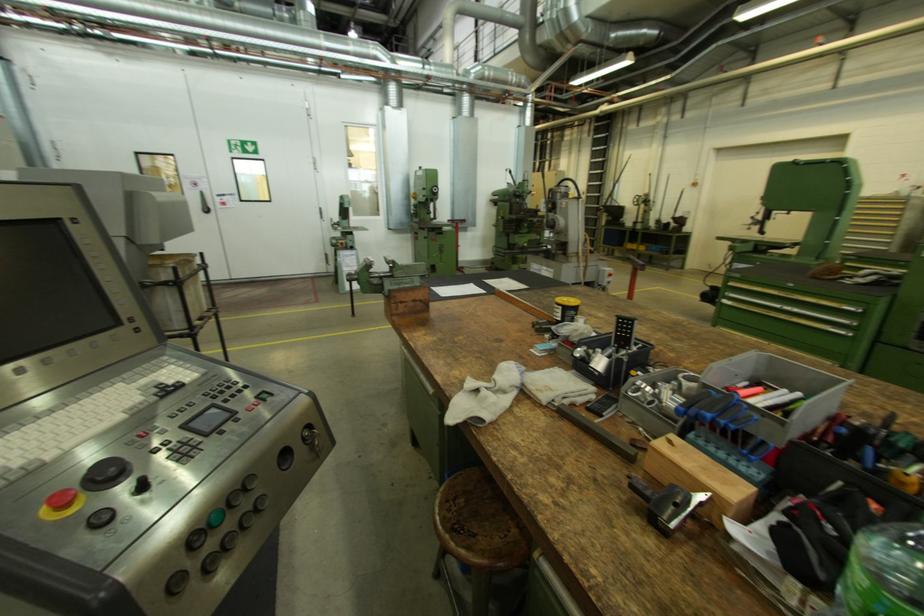
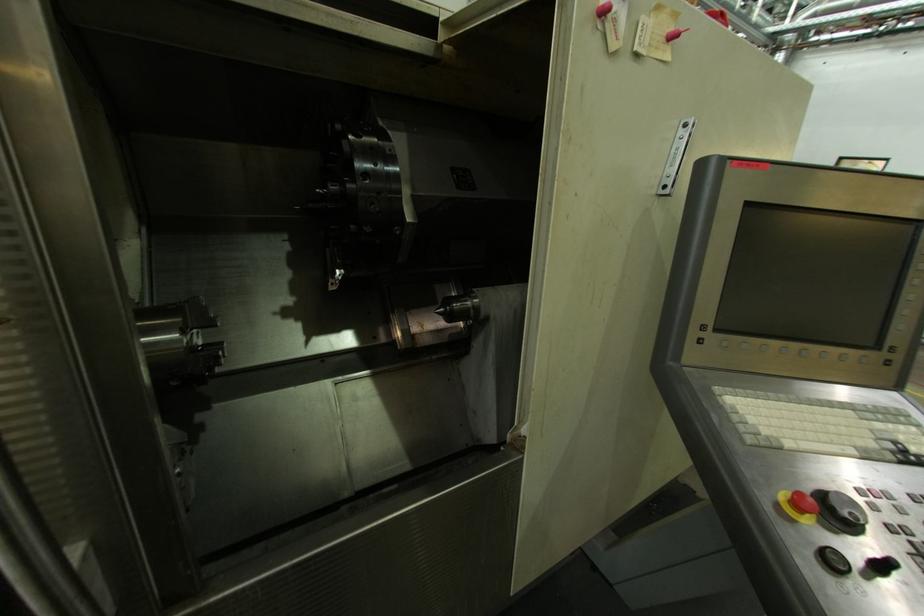
Locate, in the second image, the point that corresponds to point (50, 514) in the first image.

(787, 498)